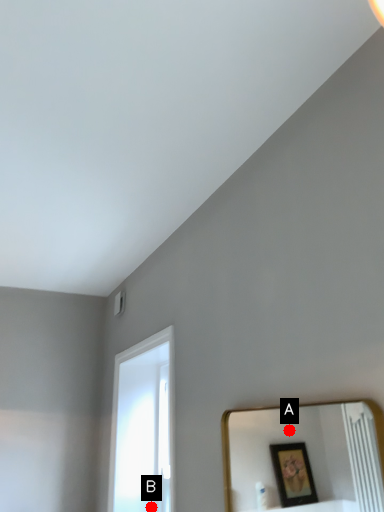
Question: Two points are circled on the image, labeled by A and B beside each circle. Which point appears closest to the camera in this image?

Choices:
 (A) A is closer
 (B) B is closer

Answer: (B)